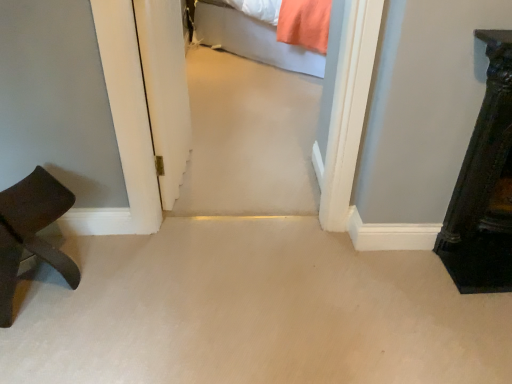
Where is `transparent glass door at center`? transparent glass door at center is located at coordinates (165, 90).

Find the location of a particular element. light gray fabric bed at upper center is located at coordinates (252, 39).

At what (x,y) coordinates should I click in order to perform the action: click on dark brown wood stool at left, the 1th furniture positioned from the left. Please return your answer as a coordinate pair (x, y). This screenshot has height=384, width=512. Looking at the image, I should click on (31, 232).

The image size is (512, 384). Find the location of `dark wood dresser at right, the 2th furniture viewed from the left`. dark wood dresser at right, the 2th furniture viewed from the left is located at coordinates (484, 186).

Who is smaller, light gray fabric bed at upper center or transparent glass door at center?

With smaller size is transparent glass door at center.

From a real-world perspective, relative to transparent glass door at center, is light gray fabric bed at upper center vertically above or below?

light gray fabric bed at upper center is below transparent glass door at center.

Is light gray fabric bed at upper center turned away from transparent glass door at center?

No, light gray fabric bed at upper center is not facing away from transparent glass door at center.

Can you confirm if dark brown wood stool at left, which is counted as the 2th furniture, starting from the right, is thinner than light gray fabric bed at upper center?

Correct, the width of dark brown wood stool at left, which is counted as the 2th furniture, starting from the right, is less than that of light gray fabric bed at upper center.

Does dark brown wood stool at left, which is counted as the 2th furniture, starting from the right, touch light gray fabric bed at upper center?

dark brown wood stool at left, which is counted as the 2th furniture, starting from the right, and light gray fabric bed at upper center are clearly separated.

Is dark brown wood stool at left, the 1th furniture positioned from the left, to the right of light gray fabric bed at upper center from the viewer's perspective?

No, dark brown wood stool at left, the 1th furniture positioned from the left, is not to the right of light gray fabric bed at upper center.

From a real-world perspective, who is located higher, dark brown wood stool at left, the 1th furniture positioned from the left, or light gray fabric bed at upper center?

From a 3D spatial view, light gray fabric bed at upper center is above.

How many degrees apart are the facing directions of light gray fabric bed at upper center and dark brown wood stool at left, the 1th furniture positioned from the left?

2.12 degrees separate the facing orientations of light gray fabric bed at upper center and dark brown wood stool at left, the 1th furniture positioned from the left.

In terms of size, does light gray fabric bed at upper center appear bigger or smaller than dark brown wood stool at left, the 1th furniture positioned from the left?

In the image, light gray fabric bed at upper center appears to be larger than dark brown wood stool at left, the 1th furniture positioned from the left.

Considering the relative sizes of light gray fabric bed at upper center and dark brown wood stool at left, the 1th furniture positioned from the left, in the image provided, is light gray fabric bed at upper center wider than dark brown wood stool at left, the 1th furniture positioned from the left,?

Indeed, light gray fabric bed at upper center has a greater width compared to dark brown wood stool at left, the 1th furniture positioned from the left.

Find the location of `furniture on the left of the dark wood dresser at right, positioned as the first furniture in right-to-left order`. furniture on the left of the dark wood dresser at right, positioned as the first furniture in right-to-left order is located at coordinates (31, 232).

Can dark wood dresser at right, the 2th furniture viewed from the left, be found inside dark brown wood stool at left, the 1th furniture positioned from the left?

No, dark wood dresser at right, the 2th furniture viewed from the left, is not surrounded by dark brown wood stool at left, the 1th furniture positioned from the left.

Are dark brown wood stool at left, which is counted as the 2th furniture, starting from the right, and dark wood dresser at right, positioned as the first furniture in right-to-left order, beside each other?

No, dark brown wood stool at left, which is counted as the 2th furniture, starting from the right, is not with dark wood dresser at right, positioned as the first furniture in right-to-left order.

Based on the photo, which is farther from the camera, [8,308] or [508,264]?

The point [508,264] is farther from the camera.

Can you tell me how much dark wood dresser at right, the 2th furniture viewed from the left, and transparent glass door at center differ in facing direction?

The angle between the facing direction of dark wood dresser at right, the 2th furniture viewed from the left, and the facing direction of transparent glass door at center is 89.4 degrees.

Which object is positioned more to the right, dark wood dresser at right, positioned as the first furniture in right-to-left order, or transparent glass door at center?

Positioned to the right is dark wood dresser at right, positioned as the first furniture in right-to-left order.

Is dark wood dresser at right, positioned as the first furniture in right-to-left order, not close to transparent glass door at center?

dark wood dresser at right, positioned as the first furniture in right-to-left order, is positioned a significant distance from transparent glass door at center.

Which is more to the right, transparent glass door at center or dark wood dresser at right, the 2th furniture viewed from the left?

From the viewer's perspective, dark wood dresser at right, the 2th furniture viewed from the left, appears more on the right side.

Find the location of `glass door located above the dark wood dresser at right, positioned as the first furniture in right-to-left order (from the image's perspective)`. glass door located above the dark wood dresser at right, positioned as the first furniture in right-to-left order (from the image's perspective) is located at coordinates (165, 90).

Considering the points (156, 42) and (482, 189), which point is behind, point (156, 42) or point (482, 189)?

Point (482, 189)

Looking at this image, from a real-world perspective, is transparent glass door at center over dark wood dresser at right, positioned as the first furniture in right-to-left order?

Yes.

Which of these two, transparent glass door at center or dark brown wood stool at left, the 1th furniture positioned from the left, stands shorter?

Standing shorter between the two is dark brown wood stool at left, the 1th furniture positioned from the left.

Is transparent glass door at center to the left of dark brown wood stool at left, which is counted as the 2th furniture, starting from the right, from the viewer's perspective?

No, transparent glass door at center is not to the left of dark brown wood stool at left, which is counted as the 2th furniture, starting from the right.

Based on the photo, between transparent glass door at center and dark brown wood stool at left, which is counted as the 2th furniture, starting from the right, which one has larger size?

Bigger between the two is transparent glass door at center.

Considering their positions, is transparent glass door at center located in front of or behind dark brown wood stool at left, which is counted as the 2th furniture, starting from the right?

Visually, transparent glass door at center is located behind dark brown wood stool at left, which is counted as the 2th furniture, starting from the right.

Where is `glass door positioned vertically above the light gray fabric bed at upper center (from a real-world perspective)`? This screenshot has width=512, height=384. glass door positioned vertically above the light gray fabric bed at upper center (from a real-world perspective) is located at coordinates (165, 90).

Locate an element on the screen. bed on the right of dark brown wood stool at left, the 1th furniture positioned from the left is located at coordinates click(x=252, y=39).

Looking at the image, which one is located further to dark brown wood stool at left, which is counted as the 2th furniture, starting from the right, transparent glass door at center or dark wood dresser at right, the 2th furniture viewed from the left?

The object further to dark brown wood stool at left, which is counted as the 2th furniture, starting from the right, is dark wood dresser at right, the 2th furniture viewed from the left.

Which object lies further to the anchor point transparent glass door at center, light gray fabric bed at upper center or dark wood dresser at right, positioned as the first furniture in right-to-left order?

light gray fabric bed at upper center is positioned further to the anchor transparent glass door at center.

Consider the image. Estimate the real-world distances between objects in this image. Which object is closer to light gray fabric bed at upper center, dark wood dresser at right, positioned as the first furniture in right-to-left order, or transparent glass door at center?

transparent glass door at center is closer to light gray fabric bed at upper center.

Which object lies nearer to the anchor point light gray fabric bed at upper center, dark brown wood stool at left, the 1th furniture positioned from the left, or transparent glass door at center?

transparent glass door at center is closer to light gray fabric bed at upper center.

Which object lies further to the anchor point dark wood dresser at right, positioned as the first furniture in right-to-left order, light gray fabric bed at upper center or transparent glass door at center?

light gray fabric bed at upper center is further to dark wood dresser at right, positioned as the first furniture in right-to-left order.

Considering their positions, is transparent glass door at center positioned closer to dark wood dresser at right, the 2th furniture viewed from the left, than light gray fabric bed at upper center?

Among the two, transparent glass door at center is located nearer to dark wood dresser at right, the 2th furniture viewed from the left.

When comparing their distances from light gray fabric bed at upper center, does dark wood dresser at right, the 2th furniture viewed from the left, or dark brown wood stool at left, the 1th furniture positioned from the left, seem closer?

dark wood dresser at right, the 2th furniture viewed from the left, lies closer to light gray fabric bed at upper center than the other object.

Based on their spatial positions, is dark brown wood stool at left, which is counted as the 2th furniture, starting from the right, or light gray fabric bed at upper center further from transparent glass door at center?

light gray fabric bed at upper center.

Where is `glass door positioned between dark wood dresser at right, the 2th furniture viewed from the left, and light gray fabric bed at upper center from near to far`? The width and height of the screenshot is (512, 384). glass door positioned between dark wood dresser at right, the 2th furniture viewed from the left, and light gray fabric bed at upper center from near to far is located at coordinates (165, 90).

I want to click on glass door between dark brown wood stool at left, which is counted as the 2th furniture, starting from the right, and light gray fabric bed at upper center from front to back, so click(165, 90).

The height and width of the screenshot is (384, 512). What are the coordinates of `furniture between dark brown wood stool at left, the 1th furniture positioned from the left, and light gray fabric bed at upper center from front to back` in the screenshot? It's located at (484, 186).

Identify the location of glass door situated between dark brown wood stool at left, the 1th furniture positioned from the left, and dark wood dresser at right, positioned as the first furniture in right-to-left order, from left to right. (165, 90).